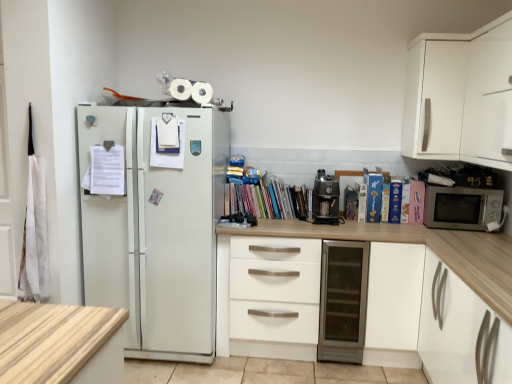
The height and width of the screenshot is (384, 512). I want to click on free space in front of hardcover book at right, the 4th paperback book from the left, so click(x=408, y=228).